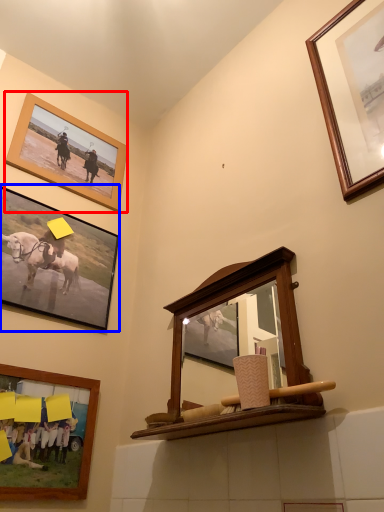
Question: Which point is closer to the camera, picture frame (highlighted by a red box) or picture frame (highlighted by a blue box)?

Choices:
 (A) picture frame
 (B) picture frame

Answer: (B)